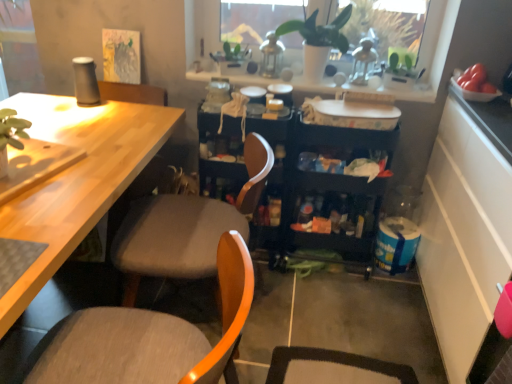
The image size is (512, 384). What do you see at coordinates (321, 181) in the screenshot?
I see `black plastic storage cart at center` at bounding box center [321, 181].

This screenshot has width=512, height=384. I want to click on light wood desk at left, so click(76, 179).

Is wooden chair at center, which appears as the second chair when viewed from the back, wider or thinner than green matte plant at upper center?

wooden chair at center, which appears as the second chair when viewed from the back, is wider than green matte plant at upper center.

Between wooden chair at center, which appears as the second chair when viewed from the back, and green matte plant at upper center, which one has more height?

With more height is wooden chair at center, which appears as the second chair when viewed from the back.

Can you confirm if wooden chair at center, which appears as the second chair when viewed from the back, is positioned to the left of green matte plant at upper center?

Correct, you'll find wooden chair at center, which appears as the second chair when viewed from the back, to the left of green matte plant at upper center.

Is black plastic storage cart at center closer to the viewer compared to wooden chair at center, which appears as the second chair when viewed from the back?

No, black plastic storage cart at center is behind wooden chair at center, which appears as the second chair when viewed from the back.

From the image's perspective, would you say black plastic storage cart at center is positioned over wooden chair at center, which appears as the second chair when viewed from the back?

Yes, from the image's perspective, black plastic storage cart at center is above wooden chair at center, which appears as the second chair when viewed from the back.

Considering the sizes of black plastic storage cart at center and wooden chair at center, placed as the 1th chair when sorted from front to back, in the image, is black plastic storage cart at center wider or thinner than wooden chair at center, placed as the 1th chair when sorted from front to back,?

In the image, black plastic storage cart at center appears to be more narrow than wooden chair at center, placed as the 1th chair when sorted from front to back.

In the scene shown: Is black plastic storage cart at center bigger or smaller than fabric cushioned chair at center, positioned as the 2th chair in front-to-back order?

In the image, black plastic storage cart at center appears to be smaller than fabric cushioned chair at center, positioned as the 2th chair in front-to-back order.

Based on the photo, choose the correct answer: Is black plastic storage cart at center inside fabric cushioned chair at center, the 1th chair from the back, or outside it?

black plastic storage cart at center exists outside the volume of fabric cushioned chair at center, the 1th chair from the back.

Is black plastic storage cart at center not close to fabric cushioned chair at center, the 1th chair from the back?

No, black plastic storage cart at center is in close proximity to fabric cushioned chair at center, the 1th chair from the back.

Can you confirm if white textured tray at upper center is wider than black plastic storage cart at center?

No.

Is white textured tray at upper center aimed at black plastic storage cart at center?

No, white textured tray at upper center is not facing towards black plastic storage cart at center.

Is white textured tray at upper center touching black plastic storage cart at center?

No, white textured tray at upper center is not touching black plastic storage cart at center.

What's the angular difference between white textured tray at upper center and black plastic storage cart at center's facing directions?

1.21 degrees separate the facing orientations of white textured tray at upper center and black plastic storage cart at center.

Considering the relative sizes of white textured tray at upper center and green matte plant at upper center in the image provided, is white textured tray at upper center shorter than green matte plant at upper center?

Indeed, white textured tray at upper center has a lesser height compared to green matte plant at upper center.

Can you tell me how much white textured tray at upper center and green matte plant at upper center differ in facing direction?

3.51 degrees separate the facing orientations of white textured tray at upper center and green matte plant at upper center.

Is white textured tray at upper center placed right next to green matte plant at upper center?

No, white textured tray at upper center is not making contact with green matte plant at upper center.

Who is bigger, white textured tray at upper center or green matte plant at upper center?

With larger size is green matte plant at upper center.

Is light wood desk at left facing away from wooden chair at center, placed as the 1th chair when sorted from front to back?

No, light wood desk at left's orientation is not away from wooden chair at center, placed as the 1th chair when sorted from front to back.

Between light wood desk at left and wooden chair at center, placed as the 1th chair when sorted from front to back, which one appears on the right side from the viewer's perspective?

wooden chair at center, placed as the 1th chair when sorted from front to back, is more to the right.

Could you measure the distance between light wood desk at left and wooden chair at center, which appears as the second chair when viewed from the back?

light wood desk at left and wooden chair at center, which appears as the second chair when viewed from the back, are 19.65 inches apart.

From the image's perspective, who appears lower, light wood desk at left or wooden chair at center, placed as the 1th chair when sorted from front to back?

wooden chair at center, placed as the 1th chair when sorted from front to back, from the image's perspective.

Which is less distant, (106, 329) or (39, 213)?

Point (106, 329) is positioned farther from the camera compared to point (39, 213).

What's the angular difference between wooden chair at center, placed as the 1th chair when sorted from front to back, and light wood desk at left's facing directions?

There is a 92-degree angle between the facing directions of wooden chair at center, placed as the 1th chair when sorted from front to back, and light wood desk at left.

From their relative heights in the image, would you say wooden chair at center, placed as the 1th chair when sorted from front to back, is taller or shorter than light wood desk at left?

In the image, wooden chair at center, placed as the 1th chair when sorted from front to back, appears to be shorter than light wood desk at left.

From a real-world perspective, which is physically above, wooden chair at center, placed as the 1th chair when sorted from front to back, or light wood desk at left?

In real-world perspective, wooden chair at center, placed as the 1th chair when sorted from front to back, is above.

Where is `chair that is the 2nd object to the left of the green matte plant at upper center, starting at the anchor`? Image resolution: width=512 pixels, height=384 pixels. chair that is the 2nd object to the left of the green matte plant at upper center, starting at the anchor is located at coordinates (149, 337).

The height and width of the screenshot is (384, 512). In the image, there is a wooden chair at center, which appears as the second chair when viewed from the back. What are the coordinates of `cabinetry below it (from a real-world perspective)` in the screenshot? It's located at (321, 181).

Estimate the real-world distances between objects in this image. Which object is closer to white textured tray at upper center, white matte plant pot at upper center or light wood desk at left?

white matte plant pot at upper center is closer to white textured tray at upper center.

Based on their spatial positions, is light wood desk at left or green matte plant at upper center further from white matte plant pot at upper center?

The object further to white matte plant pot at upper center is light wood desk at left.

Which object lies nearer to the anchor point light wood desk at left, wooden chair at center, placed as the 1th chair when sorted from front to back, or black plastic storage cart at center?

The object closer to light wood desk at left is wooden chair at center, placed as the 1th chair when sorted from front to back.

From the image, which object appears to be nearer to white textured tray at upper center, light wood desk at left or white matte plant pot at upper center?

white matte plant pot at upper center.

Looking at the image, which one is located further to black plastic storage cart at center, wooden chair at center, placed as the 1th chair when sorted from front to back, or fabric cushioned chair at center, positioned as the 2th chair in front-to-back order?

The object further to black plastic storage cart at center is wooden chair at center, placed as the 1th chair when sorted from front to back.

When comparing their distances from white matte plant pot at upper center, does light wood desk at left or fabric cushioned chair at center, positioned as the 2th chair in front-to-back order, seem closer?

light wood desk at left lies closer to white matte plant pot at upper center than the other object.

From the image, which object appears to be farther from white textured tray at upper center, white matte plant pot at upper center or black plastic storage cart at center?

black plastic storage cart at center.

Which object lies further to the anchor point light wood desk at left, white matte plant pot at upper center or white textured tray at upper center?

white matte plant pot at upper center.

The width and height of the screenshot is (512, 384). Find the location of `cabinetry that lies between white textured tray at upper center and fabric cushioned chair at center, the 1th chair from the back, from top to bottom`. cabinetry that lies between white textured tray at upper center and fabric cushioned chair at center, the 1th chair from the back, from top to bottom is located at coordinates (321, 181).

Where is `cabinetry between wooden chair at center, which appears as the second chair when viewed from the back, and white matte plant pot at upper center, along the z-axis`? The width and height of the screenshot is (512, 384). cabinetry between wooden chair at center, which appears as the second chair when viewed from the back, and white matte plant pot at upper center, along the z-axis is located at coordinates (321, 181).

What are the coordinates of `desk between white matte plant pot at upper center and fabric cushioned chair at center, the 1th chair from the back, from top to bottom` in the screenshot? It's located at (76, 179).

At what (x,y) coordinates should I click in order to perform the action: click on window sill that lies between green matte plant at upper center and black plastic storage cart at center from top to bottom. Please return your answer as a coordinate pair (x, y). The height and width of the screenshot is (384, 512). Looking at the image, I should click on (369, 90).